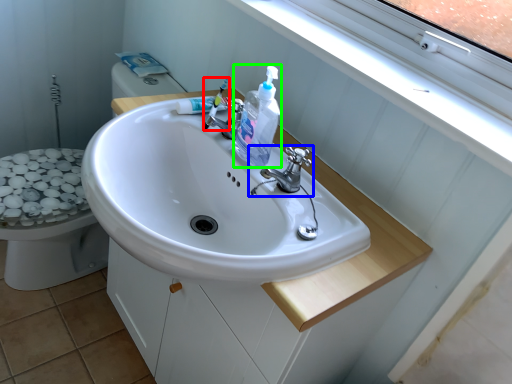
Question: Which is farther away from toothbrush (highlighted by a red box)? tap (highlighted by a blue box) or cleaning product (highlighted by a green box)?

Choices:
 (A) tap
 (B) cleaning product

Answer: (A)